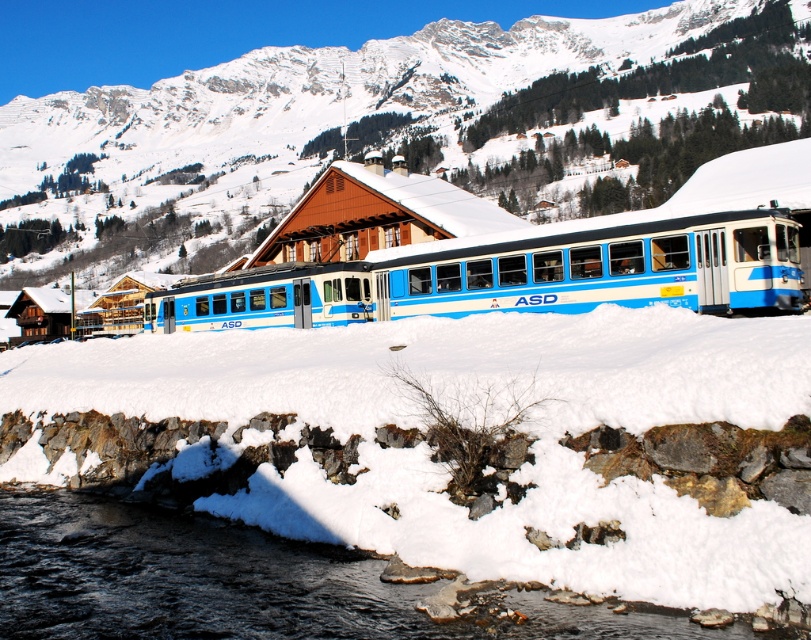
Does snowy mountain at upper center have a smaller size compared to blue painted metal train at center?

Incorrect, snowy mountain at upper center is not smaller in size than blue painted metal train at center.

From the picture: Who is lower down, snowy mountain at upper center or blue painted metal train at center?

blue painted metal train at center

You are a GUI agent. You are given a task and a screenshot of the screen. Output one action in this format:
    pyautogui.click(x=<x>, y=<y>)
    Task: Click on the snowy mountain at upper center
    The image size is (811, 640).
    Given the screenshot: What is the action you would take?
    pyautogui.click(x=395, y=128)

The image size is (811, 640). Identify the location of snowy mountain at upper center. (395, 128).

Can you confirm if black water at lower left is positioned above blue painted metal train at center?

No, black water at lower left is not above blue painted metal train at center.

Which is behind, point (79, 496) or point (698, 236)?

Positioned behind is point (79, 496).

In order to click on black water at lower left in this screenshot , I will do `click(243, 582)`.

Is snowy mountain at upper center thinner than black water at lower left?

In fact, snowy mountain at upper center might be wider than black water at lower left.

Is snowy mountain at upper center above black water at lower left?

Yes.

What do you see at coordinates (395, 128) in the screenshot?
I see `snowy mountain at upper center` at bounding box center [395, 128].

The width and height of the screenshot is (811, 640). I want to click on snowy mountain at upper center, so click(395, 128).